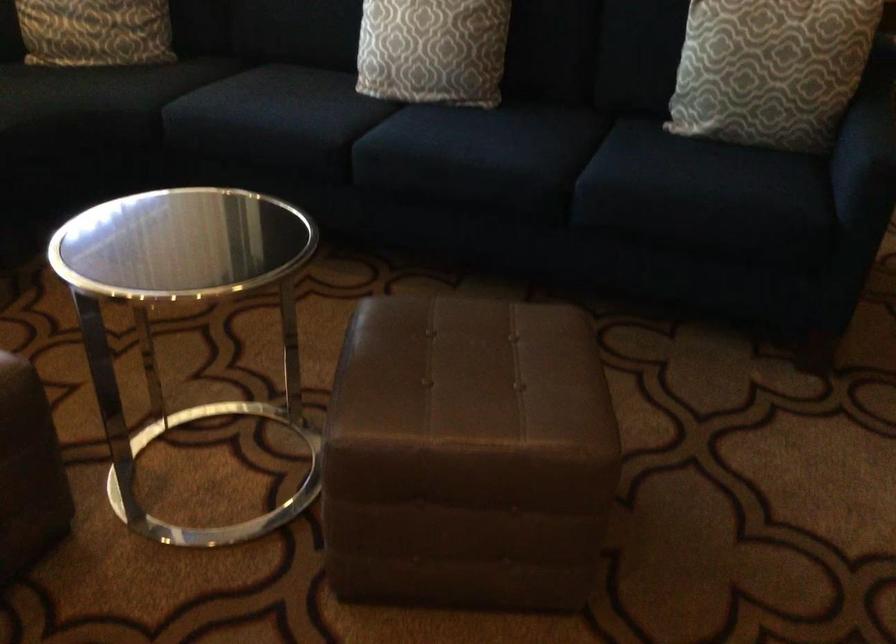
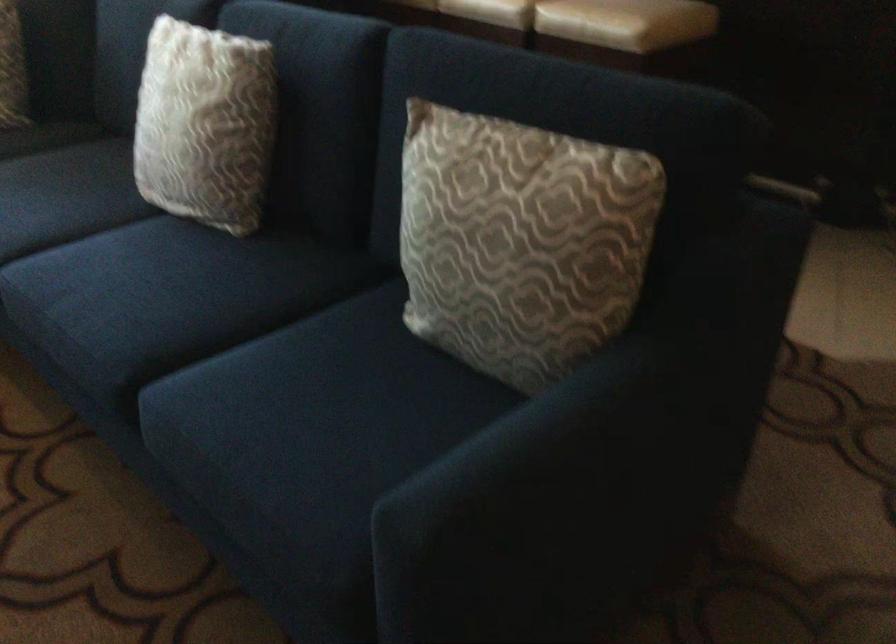
In a continuous first-person perspective shot, in which direction is the camera moving?

The cameraman moved toward right, forward.